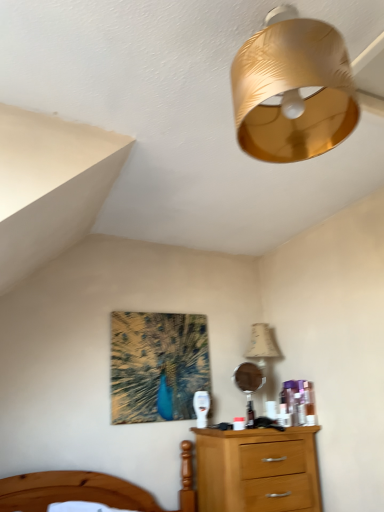
Question: Is wooden bed at lower left positioned with its back to beige fabric lampshade at upper right?

Choices:
 (A) no
 (B) yes

Answer: (A)

Question: From a real-world perspective, is wooden bed at lower left below beige fabric lampshade at upper right?

Choices:
 (A) no
 (B) yes

Answer: (B)

Question: From a real-world perspective, is wooden bed at lower left over beige fabric lampshade at upper right?

Choices:
 (A) no
 (B) yes

Answer: (A)

Question: Can you confirm if wooden bed at lower left is positioned to the left of beige fabric lampshade at upper right?

Choices:
 (A) no
 (B) yes

Answer: (B)

Question: Is wooden bed at lower left positioned before beige fabric lampshade at upper right?

Choices:
 (A) no
 (B) yes

Answer: (B)

Question: Is wooden bed at lower left facing towards beige fabric lampshade at upper right?

Choices:
 (A) no
 (B) yes

Answer: (A)

Question: From a real-world perspective, is beige fabric lampshade at upper right on top of wooden bed at lower left?

Choices:
 (A) yes
 (B) no

Answer: (A)

Question: Can you confirm if beige fabric lampshade at upper right is shorter than wooden bed at lower left?

Choices:
 (A) no
 (B) yes

Answer: (A)

Question: Is beige fabric lampshade at upper right aimed at wooden bed at lower left?

Choices:
 (A) yes
 (B) no

Answer: (B)

Question: From the image's perspective, is beige fabric lampshade at upper right below wooden bed at lower left?

Choices:
 (A) no
 (B) yes

Answer: (A)

Question: Is beige fabric lampshade at upper right to the right of wooden bed at lower left from the viewer's perspective?

Choices:
 (A) yes
 (B) no

Answer: (A)

Question: Does beige fabric lampshade at upper right have a greater height compared to wooden bed at lower left?

Choices:
 (A) yes
 (B) no

Answer: (A)

Question: Would you say gold textured lampshade at upper center is a long distance from beige fabric lampshade at upper right?

Choices:
 (A) no
 (B) yes

Answer: (B)